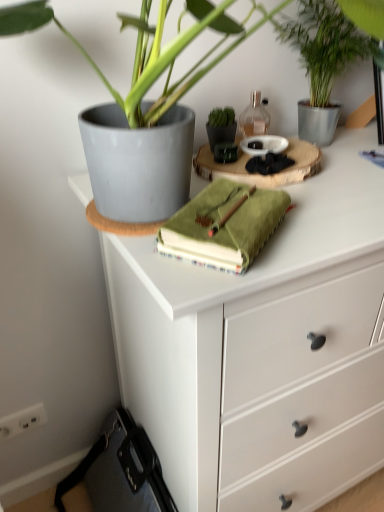
Where is `free space on the front side of green leafy plant at upper right`? This screenshot has height=512, width=384. free space on the front side of green leafy plant at upper right is located at coordinates (350, 174).